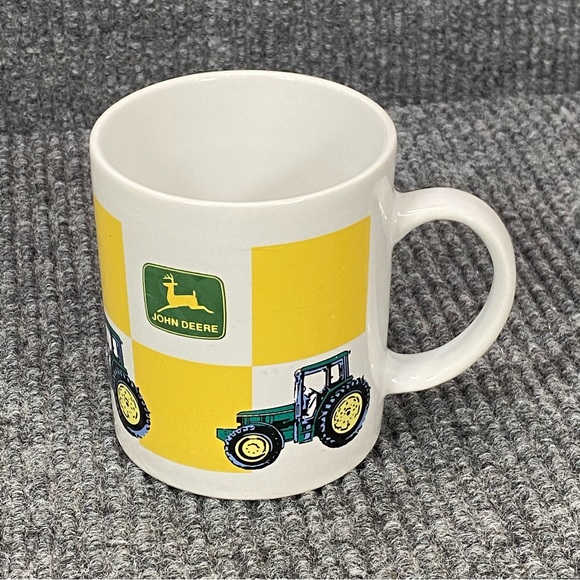
Identify the location of carpet. The image size is (580, 580). (473, 516), (34, 422), (36, 129), (469, 101), (539, 353).